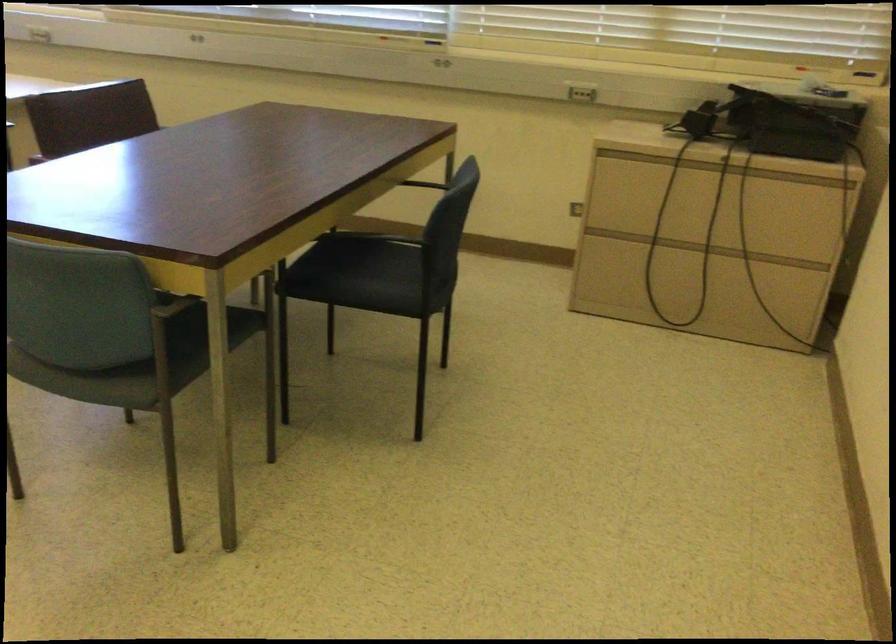
In order to click on cabinet drawer handle in this screenshot , I will do `click(700, 167)`.